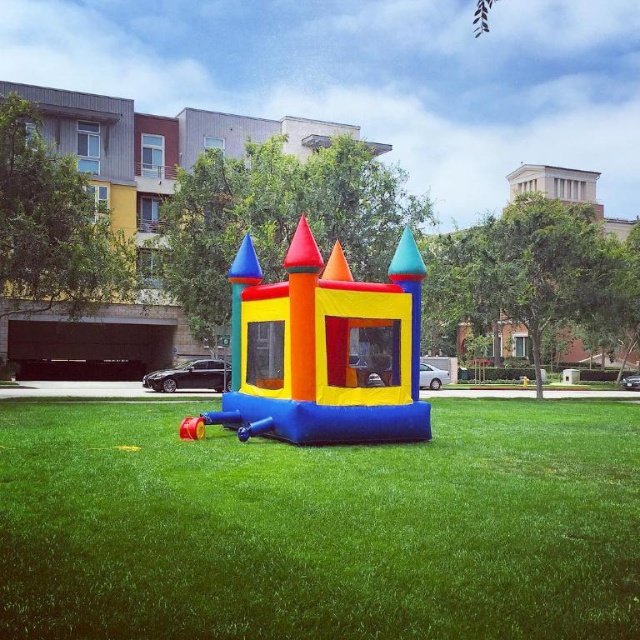
You are planning to set up a new inflatable slide next to the blue rubber bouncy castle at center and the inflatable castle at center. Which of the two castles should you place the slide closer to if you want it to be proportionally sized to the castle it is near?

The slide should be placed closer to the inflatable castle at center because the blue rubber bouncy castle at center is larger in size, so a proportionally sized slide would need to be bigger for it, but since you want the slide to be proportionally sized to the castle it is near, the smaller inflatable castle at center would require a smaller slide.

A child is standing at the edge of the blue rubber bouncy castle at center and wants to throw a ball to their friend who is standing on the grassy lawn. If the child can throw the ball 12 feet, will the ball reach their friend?

The distance between the child and their friend is 12.18 feet. Since the child can only throw 12 feet, the ball will not reach their friend.

In the scene shown: You are planning to set up a new inflatable slide next to the blue rubber bouncy castle at center and the inflatable castle at center. Based on the scene, which of the two castles requires more space for the slide to fit beside them?

The blue rubber bouncy castle at center might require more space since it is wider than the inflatable castle at center according to the description.